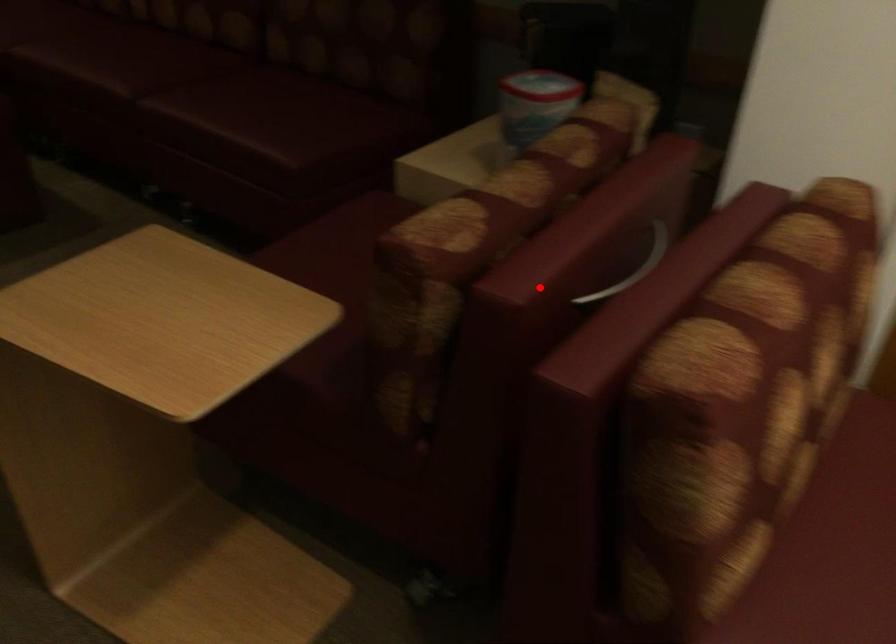
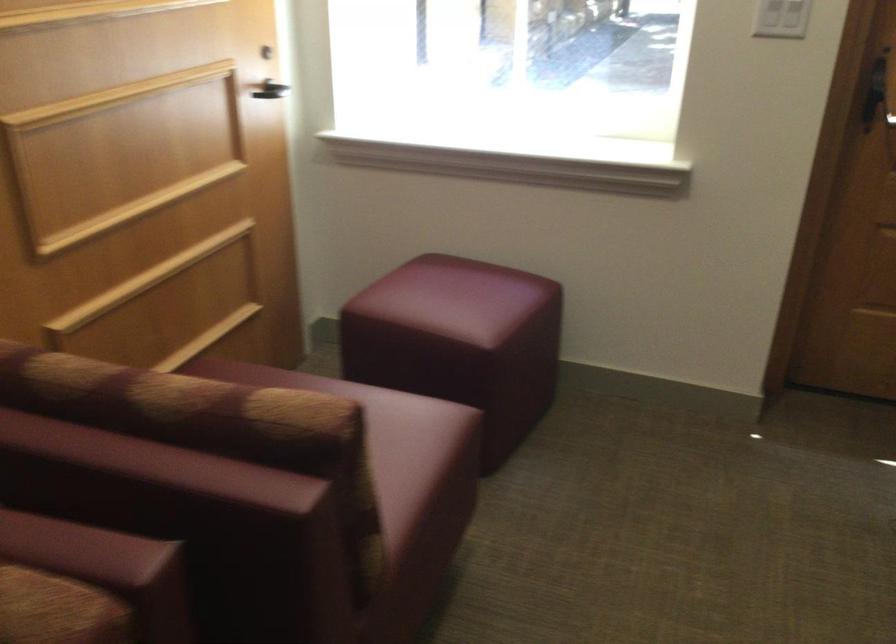
Locate, in the second image, the point that corresponds to the highlighted location in the first image.

(82, 550)